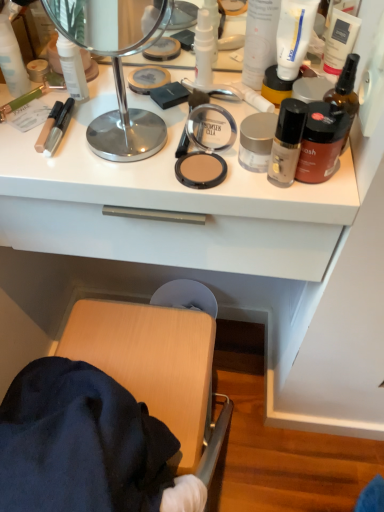
The height and width of the screenshot is (512, 384). I want to click on free space on the front side of matte white lotion at upper left, which is counted as the tenth toiletry, starting from the right, so click(x=46, y=143).